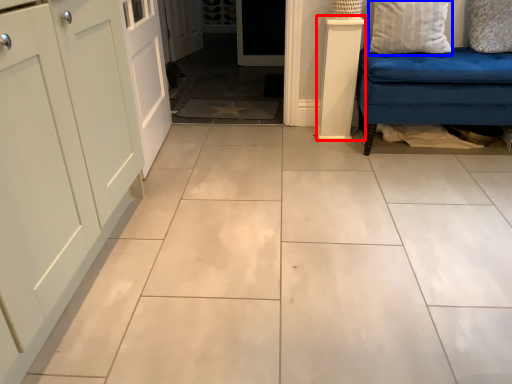
Question: Which object appears closest to the camera in this image, pillar (highlighted by a red box) or pillow (highlighted by a blue box)?

Choices:
 (A) pillar
 (B) pillow

Answer: (B)